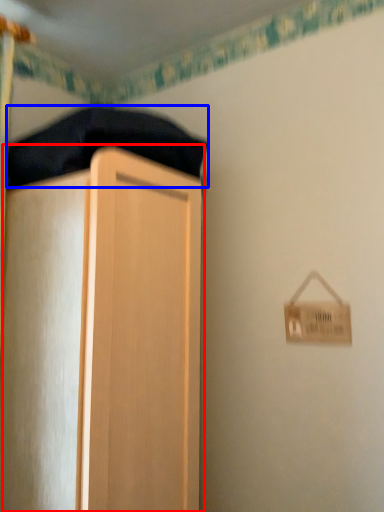
Question: Which object is closer to the camera taking this photo, cupboard (highlighted by a red box) or bedding (highlighted by a blue box)?

Choices:
 (A) cupboard
 (B) bedding

Answer: (A)